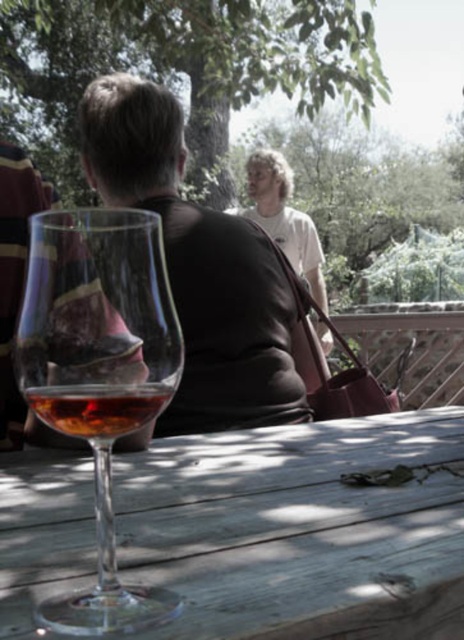
Is point (116, 394) less distant than point (315, 232)?

Yes, point (116, 394) is in front of point (315, 232).

In the scene shown: Is transparent glass wine glass at lower left taller than white cotton shirt at upper center?

No, transparent glass wine glass at lower left is not taller than white cotton shirt at upper center.

Who is more forward, [128,593] or [269,161]?

Point [128,593] is in front.

What are the coordinates of `transparent glass wine glass at lower left` in the screenshot? It's located at (98, 372).

Between point (129, 136) and point (30, 435), which one is positioned behind?

The point (129, 136) is behind.

Does brown leather jacket at upper center have a greater height compared to amber glass at center?

Correct, brown leather jacket at upper center is much taller as amber glass at center.

You are a GUI agent. You are given a task and a screenshot of the screen. Output one action in this format:
    pyautogui.click(x=<x>, y=<y>)
    Task: Click on the brown leather jacket at upper center
    The image size is (464, 640).
    Given the screenshot: What is the action you would take?
    pyautogui.click(x=199, y=269)

Locate an element on the screen. The width and height of the screenshot is (464, 640). brown leather jacket at upper center is located at coordinates (199, 269).

Is point (73, 408) positioned in front of point (115, 401)?

Yes, point (73, 408) is in front of point (115, 401).

Which is in front, point (116, 612) or point (37, 401)?

Positioned in front is point (116, 612).

This screenshot has width=464, height=640. What do you see at coordinates (98, 372) in the screenshot? I see `transparent glass wine glass at lower left` at bounding box center [98, 372].

Identify the location of transparent glass wine glass at lower left. (98, 372).